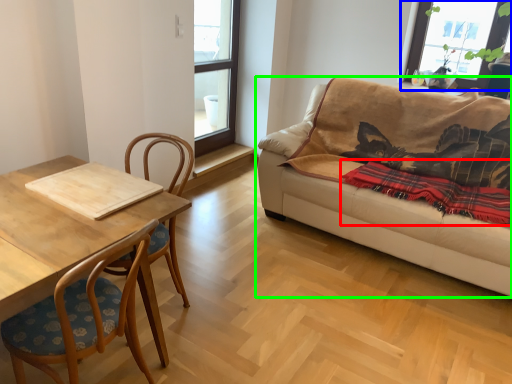
Question: Based on their relative distances, which object is nearer to blanket (highlighted by a red box)? Choose from window (highlighted by a blue box) and studio couch (highlighted by a green box).

Choices:
 (A) window
 (B) studio couch

Answer: (B)